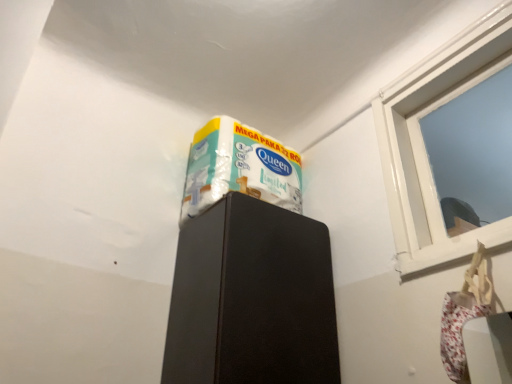
Question: From a real-world perspective, is black matte cabinet at upper center beneath white glossy window at upper right?

Choices:
 (A) no
 (B) yes

Answer: (B)

Question: From the image's perspective, is black matte cabinet at upper center under white glossy window at upper right?

Choices:
 (A) no
 (B) yes

Answer: (B)

Question: Is black matte cabinet at upper center completely or partially outside of white glossy window at upper right?

Choices:
 (A) no
 (B) yes

Answer: (B)

Question: Is black matte cabinet at upper center smaller than white glossy window at upper right?

Choices:
 (A) no
 (B) yes

Answer: (A)

Question: Considering the relative sizes of black matte cabinet at upper center and white glossy window at upper right in the image provided, is black matte cabinet at upper center bigger than white glossy window at upper right?

Choices:
 (A) yes
 (B) no

Answer: (A)

Question: Considering the positions of black matte cabinet at upper center and white glossy wrapping paper at upper center in the image, is black matte cabinet at upper center bigger or smaller than white glossy wrapping paper at upper center?

Choices:
 (A) small
 (B) big

Answer: (B)

Question: Considering the positions of point (222, 336) and point (226, 135), is point (222, 336) closer or farther from the camera than point (226, 135)?

Choices:
 (A) farther
 (B) closer

Answer: (B)

Question: Which is correct: black matte cabinet at upper center is inside white glossy wrapping paper at upper center, or outside of it?

Choices:
 (A) outside
 (B) inside

Answer: (A)

Question: From their relative heights in the image, would you say black matte cabinet at upper center is taller or shorter than white glossy wrapping paper at upper center?

Choices:
 (A) tall
 (B) short

Answer: (A)

Question: Considering their positions, is white glossy window at upper right located in front of or behind black matte cabinet at upper center?

Choices:
 (A) behind
 (B) front

Answer: (B)

Question: Is point (420, 172) positioned closer to the camera than point (185, 264)?

Choices:
 (A) closer
 (B) farther

Answer: (A)

Question: Looking at the image, does white glossy window at upper right seem bigger or smaller compared to black matte cabinet at upper center?

Choices:
 (A) big
 (B) small

Answer: (B)

Question: From the image's perspective, is white glossy window at upper right located above or below black matte cabinet at upper center?

Choices:
 (A) above
 (B) below

Answer: (A)

Question: Visually, is black matte cabinet at upper center positioned to the left or to the right of white glossy window at upper right?

Choices:
 (A) left
 (B) right

Answer: (A)

Question: From their relative heights in the image, would you say black matte cabinet at upper center is taller or shorter than white glossy window at upper right?

Choices:
 (A) tall
 (B) short

Answer: (B)